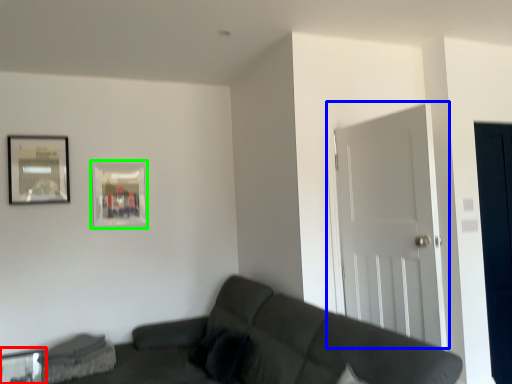
Question: Considering the real-world distances, which object is closest to glass table (highlighted by a red box)? door (highlighted by a blue box) or picture frame (highlighted by a green box).

Choices:
 (A) door
 (B) picture frame

Answer: (B)